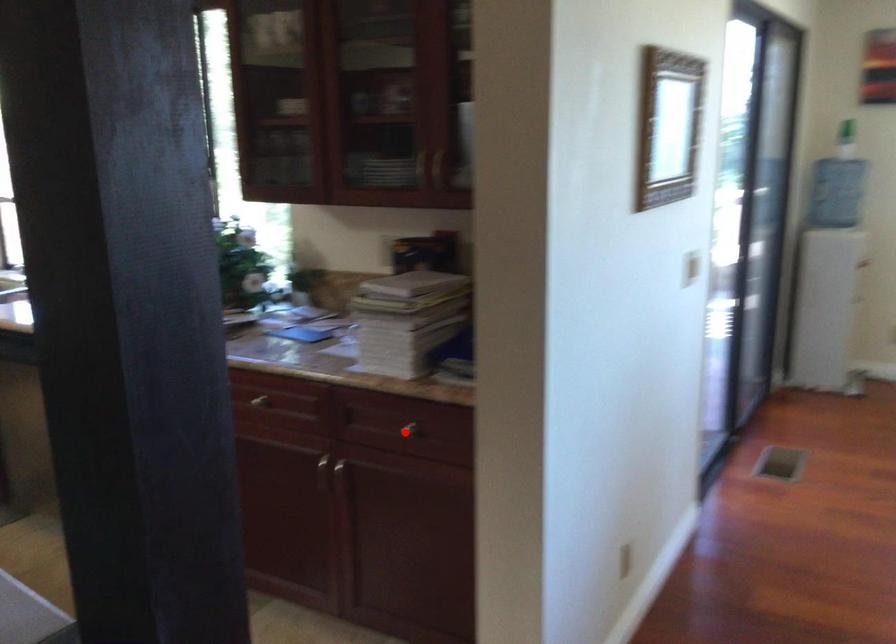
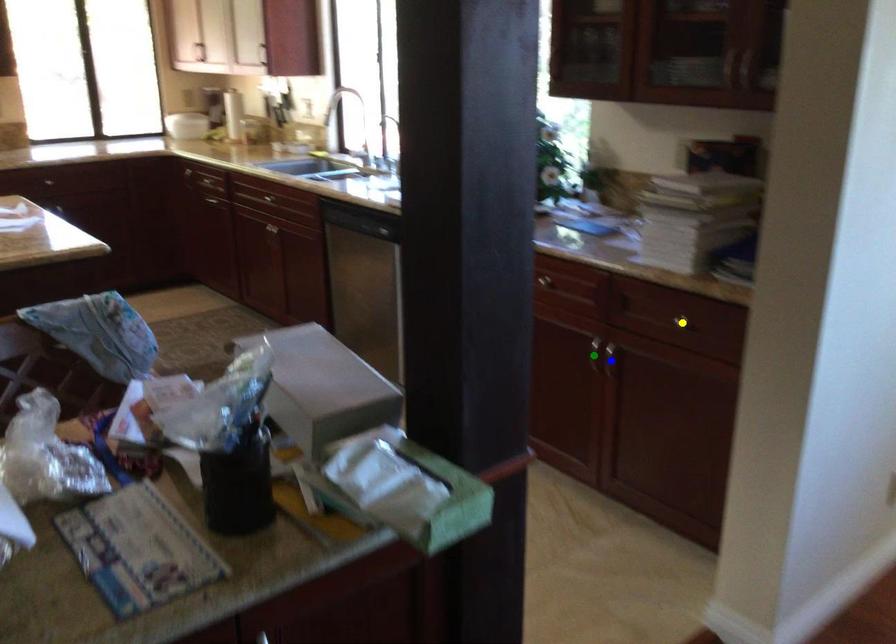
Question: I am providing you with two images of the same scene from different viewpoints. A red point is marked on the first image. You are given multiple points on the second image. Which spot in image 2 lines up with the point in image 1?

Choices:
 (A) green point
 (B) yellow point
 (C) blue point

Answer: (B)